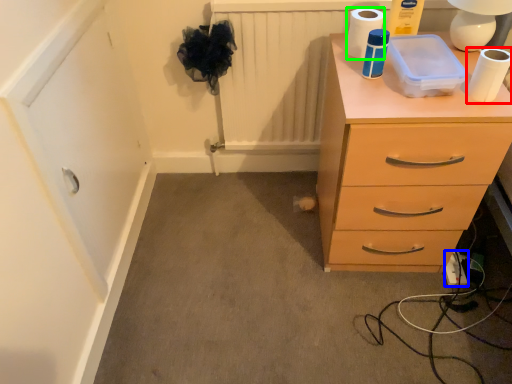
Question: Considering the real-world distances, which object is farthest from toilet paper (highlighted by a red box)? extension cord (highlighted by a blue box) or toilet paper (highlighted by a green box)?

Choices:
 (A) extension cord
 (B) toilet paper

Answer: (A)